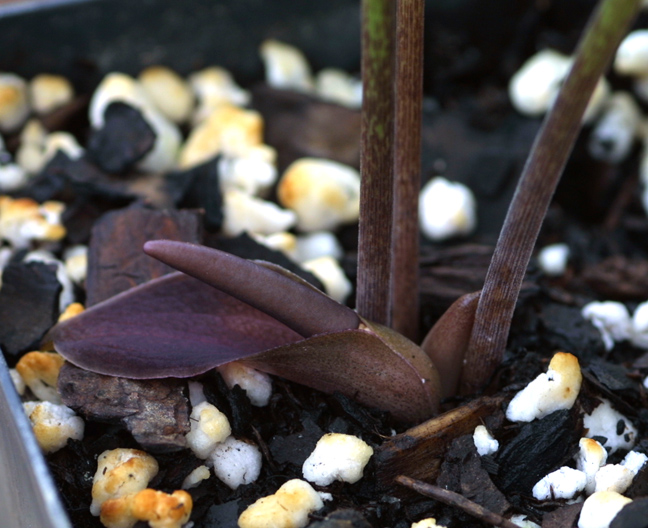
This screenshot has height=528, width=648. In order to click on planter in this screenshot , I will do `click(35, 465)`.